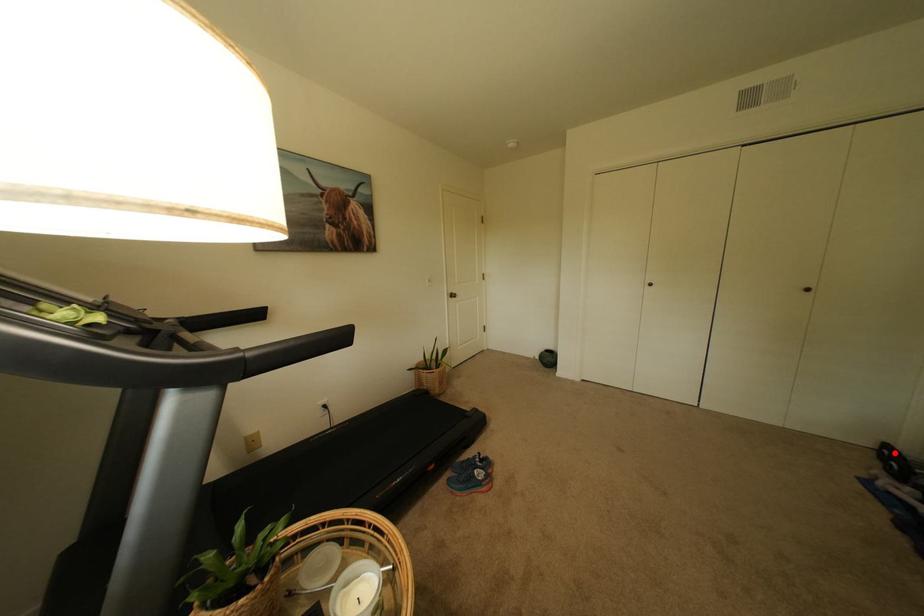
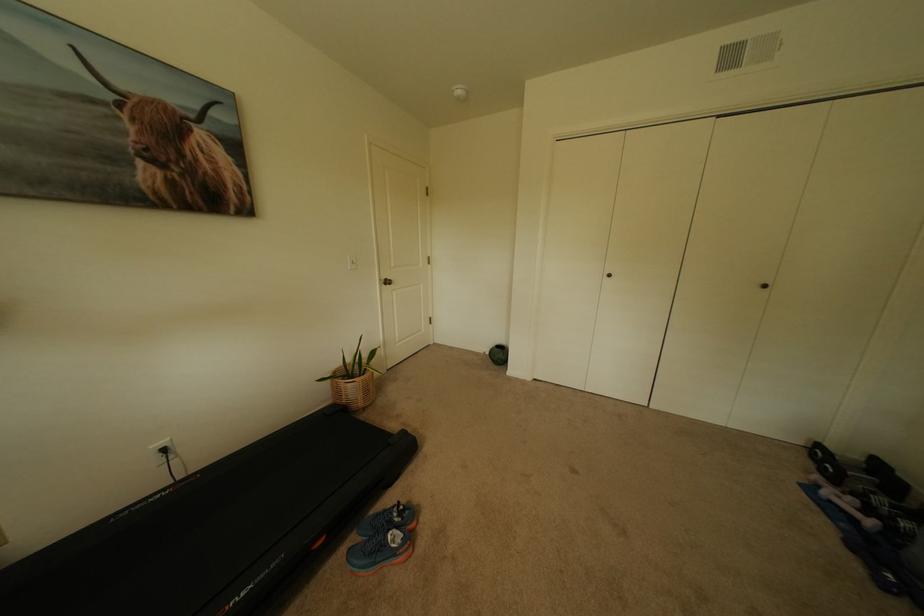
Where in the second image is the point corresponding to the highlighted location from the first image?

(827, 452)